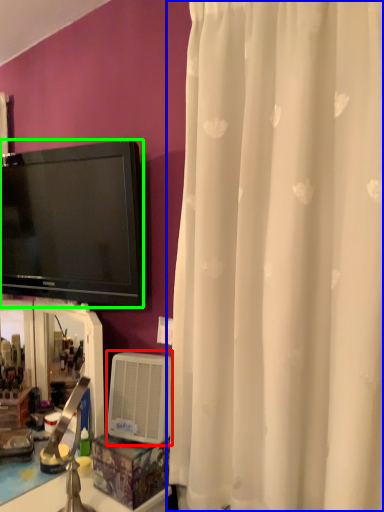
Question: Estimate the real-world distances between objects in this image. Which object is farther from air conditioner (highlighted by a red box), curtain (highlighted by a blue box) or television (highlighted by a green box)?

Choices:
 (A) curtain
 (B) television

Answer: (B)